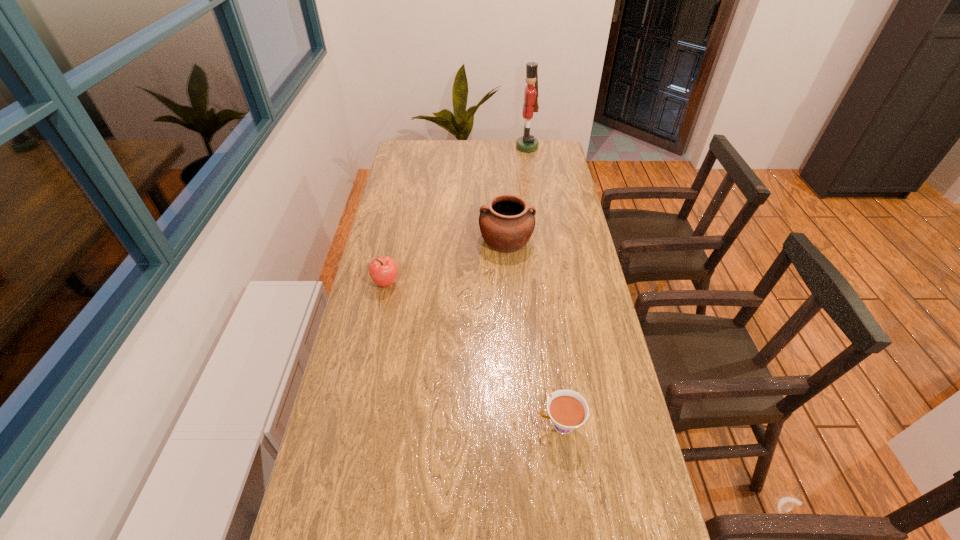
Where is `object at the far right corner`? This screenshot has height=540, width=960. object at the far right corner is located at coordinates (527, 143).

The width and height of the screenshot is (960, 540). In the image, there is a desktop. In order to click on free region at the far edge in this screenshot , I will do `click(516, 146)`.

Locate an element on the screen. Image resolution: width=960 pixels, height=540 pixels. vacant space at the left edge of the desktop is located at coordinates (377, 512).

Identify the location of vacant region at the right edge of the desktop. (551, 200).

Where is `free area in between the third tallest object and the pottery`? free area in between the third tallest object and the pottery is located at coordinates (446, 261).

I want to click on vacant area between the third farthest object and the third shortest object, so click(x=446, y=261).

This screenshot has width=960, height=540. Identify the location of unoccupied area between the pottery and the nearest object. (533, 332).

The height and width of the screenshot is (540, 960). In order to click on blank region between the teacup and the nutcracker in this screenshot , I will do `click(543, 286)`.

Locate an element on the screen. Image resolution: width=960 pixels, height=540 pixels. empty space between the farthest object and the apple is located at coordinates (457, 215).

The image size is (960, 540). I want to click on free space between the third tallest object and the nearest object, so click(473, 354).